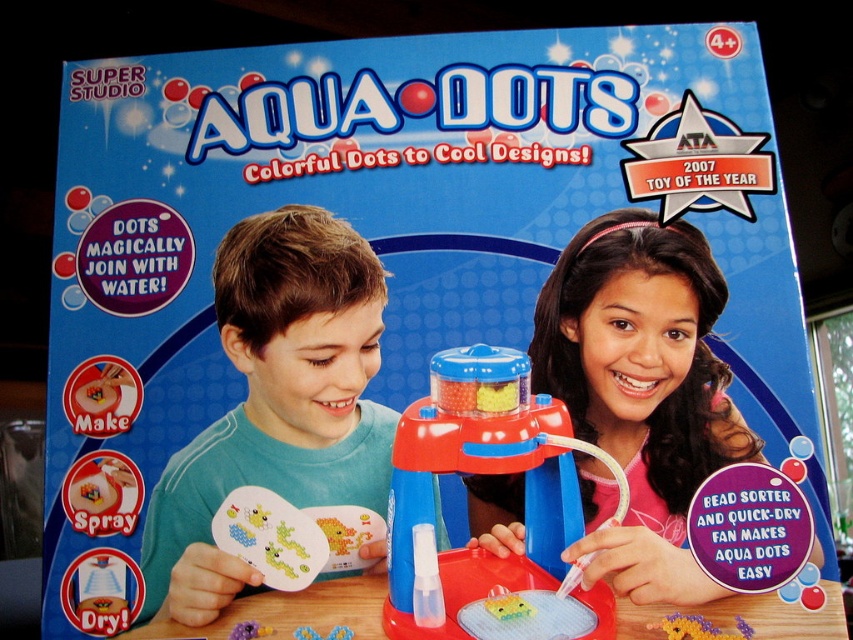
You are a child looking at the Aqua Dots product box. You see a pink fabric hairband at upper center and a blue plastic bead sorter at center. Which object is taller?

The pink fabric hairband at upper center is taller than the blue plastic bead sorter at center.

You are a child trying to decide which item to use first from the box. The pink fabric hairband at upper center and the purple matte beads at center are both visible. Which item is bigger in size?

The pink fabric hairband at upper center is larger in size compared to the purple matte beads at center.

You are a customer looking at the Aqua Dots product box. You see a matte teal shirt at center and purple matte beads at center. Which item is placed higher on the box?

The matte teal shirt at center is positioned over the purple matte beads at center, so it is placed higher.